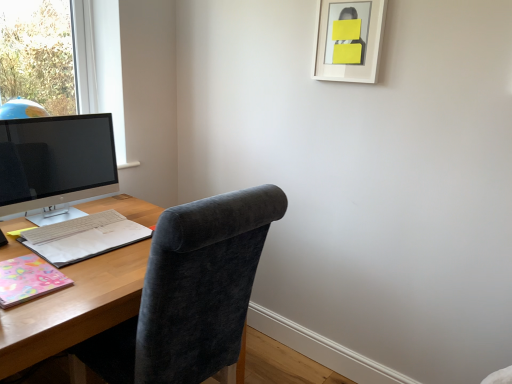
This screenshot has width=512, height=384. I want to click on free spot above multicolored paper notebook at left, acting as the first notebook starting from the back (from a real-world perspective), so click(x=93, y=230).